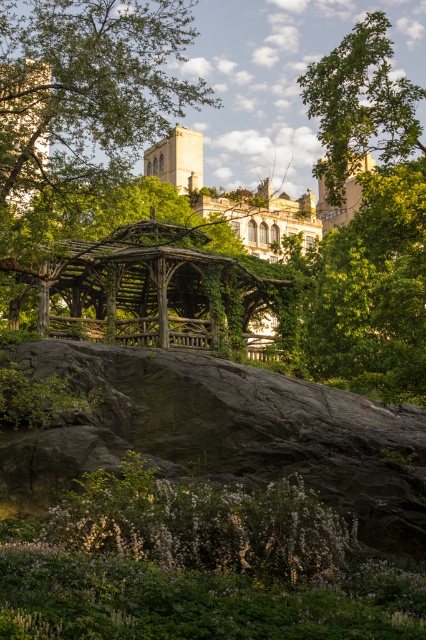
Question: Which of the following is the closest to the observer?

Choices:
 (A) (405, 93)
 (B) (371, 451)

Answer: (B)

Question: Can you confirm if dark gray rock at center is positioned above green leafy tree at upper right?

Choices:
 (A) yes
 (B) no

Answer: (B)

Question: Where is dark gray rock at center located in relation to green leafy tree at upper right in the image?

Choices:
 (A) above
 (B) below

Answer: (B)

Question: Is dark gray rock at center further to the viewer compared to green leafy tree at upper right?

Choices:
 (A) no
 (B) yes

Answer: (A)